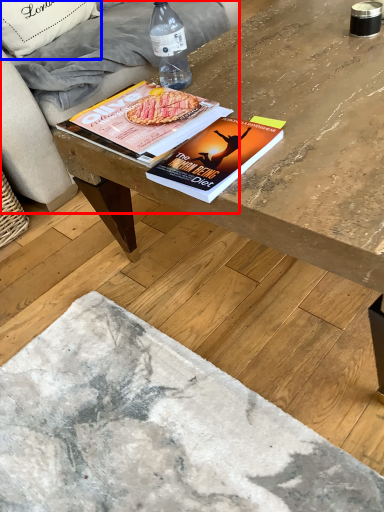
Question: Among these objects, which one is nearest to the camera, studio couch (highlighted by a red box) or throw pillow (highlighted by a blue box)?

Choices:
 (A) studio couch
 (B) throw pillow

Answer: (A)